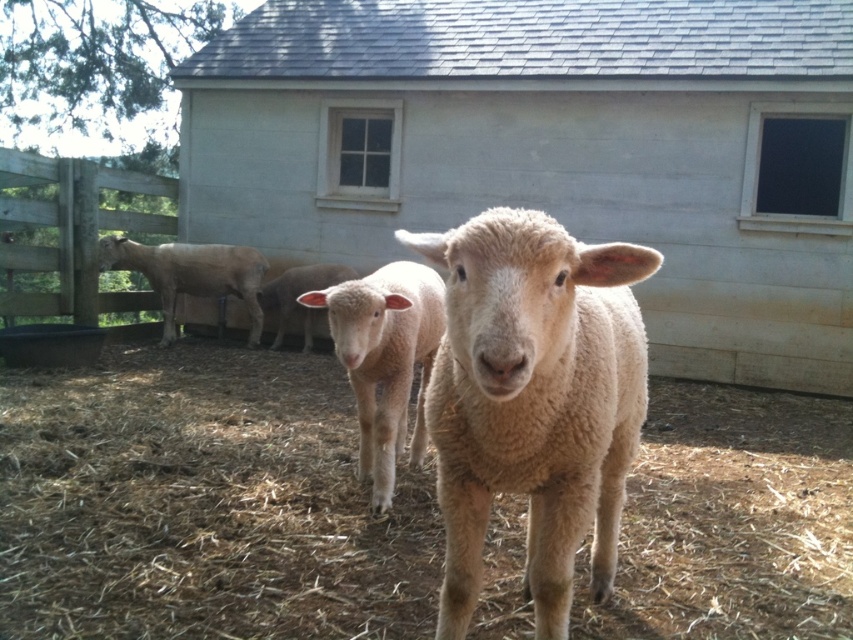
Question: Which object is positioned farthest from the wooden gate at left?

Choices:
 (A) white wooden barn at center
 (B) fuzzy beige lamb at center
 (C) fuzzy white lamb at center
 (D) light brown woolen sheep at left

Answer: (B)

Question: Is white wooden barn at center smaller than light brown woolen sheep at left?

Choices:
 (A) yes
 (B) no

Answer: (B)

Question: Can you confirm if fuzzy woolen sheep at center is smaller than light brown woolen sheep at left?

Choices:
 (A) no
 (B) yes

Answer: (A)

Question: Is fuzzy beige lamb at center closer to camera compared to fuzzy white lamb at center?

Choices:
 (A) no
 (B) yes

Answer: (B)

Question: Estimate the real-world distances between objects in this image. Which object is closer to the wooden gate at left?

Choices:
 (A) white wooden barn at center
 (B) fuzzy white lamb at center
 (C) light brown woolen sheep at left
 (D) fuzzy beige lamb at center

Answer: (C)

Question: Among these objects, which one is nearest to the camera?

Choices:
 (A) light brown woolen sheep at left
 (B) fuzzy woolen sheep at center
 (C) wooden gate at left
 (D) fuzzy white lamb at center

Answer: (B)